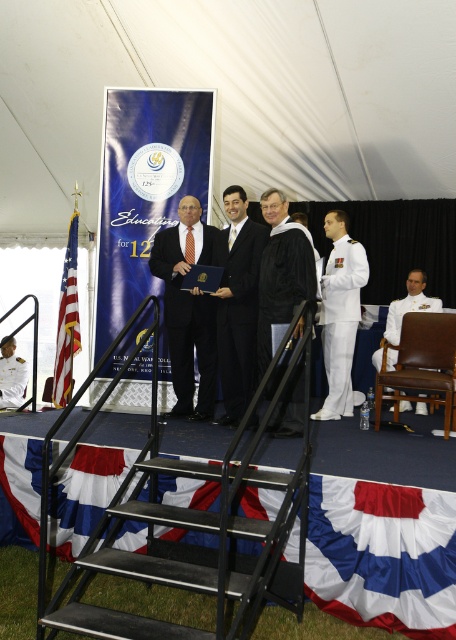
You are standing at the back of the tent and want to walk towards the stage. There are two points marked on the floor in front of you. The first point is at coordinate point (179, 272) and the second point is at coordinate point (72, 289). Which point should you step on first if you want to reach the stage quickly?

You should step on point (179, 272) first because it is in front of point (72, 289), meaning it is closer to the stage.

You are attending the graduation ceremony at the U.S. Naval War College and want to approach the stage. From your current position, which object is closer to you, the black metal stairs at lower center or the black matte graduation gown at center?

The black metal stairs at lower center are closer to the viewer than the black matte graduation gown at center, so the stairs are closer.